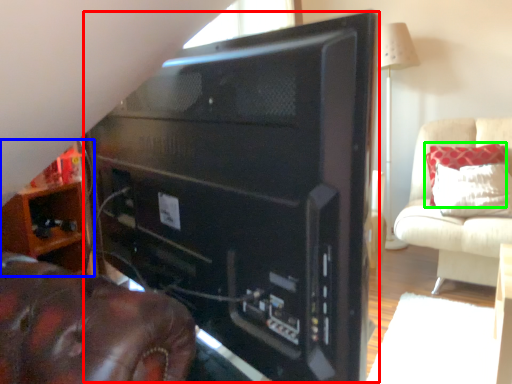
Question: Considering the real-world distances, which object is farthest from desktop computer (highlighted by a red box)? furniture (highlighted by a blue box) or pillow (highlighted by a green box)?

Choices:
 (A) furniture
 (B) pillow

Answer: (B)